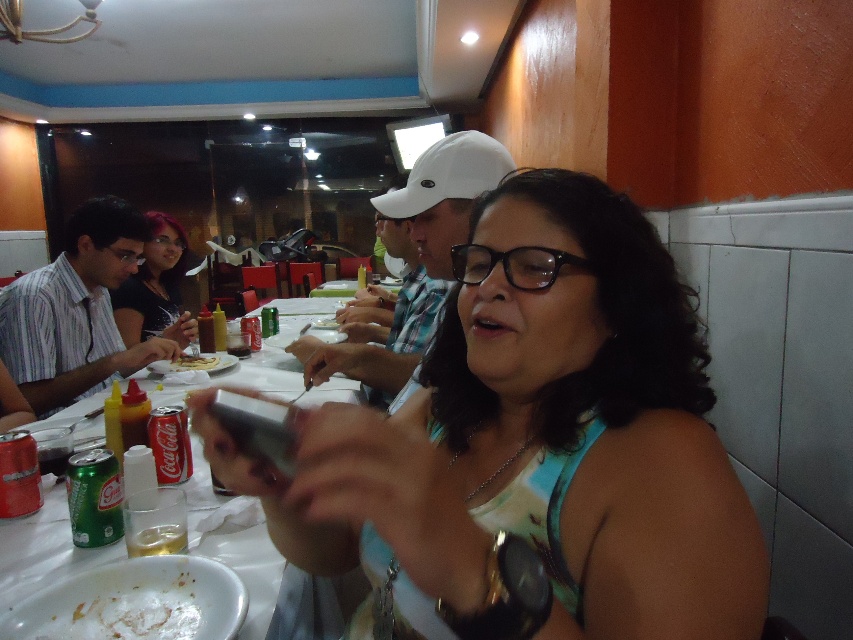
Who is more forward, (x=445, y=598) or (x=225, y=372)?

Point (x=445, y=598)

Does matte green tank top at center appear on the left side of white paper table at center?

In fact, matte green tank top at center is to the right of white paper table at center.

Does point (463, 360) come behind point (297, 376)?

No, it is not.

Identify the location of matte green tank top at center. The image size is (853, 640). (534, 448).

Which of these two, matte green tank top at center or striped fabric shirt at left, stands shorter?

With less height is matte green tank top at center.

Describe the element at coordinates (534, 448) in the screenshot. The image size is (853, 640). I see `matte green tank top at center` at that location.

I want to click on matte green tank top at center, so click(x=534, y=448).

Is point (26, 388) closer to camera compared to point (166, 528)?

No.

Measure the distance from striped fabric shirt at left to translucent plastic lemon at lower left.

striped fabric shirt at left and translucent plastic lemon at lower left are 4.41 feet apart.

Between point (44, 376) and point (160, 534), which one is positioned in front?

Point (160, 534) is in front.

In order to click on striped fabric shirt at left in this screenshot , I will do `click(76, 310)`.